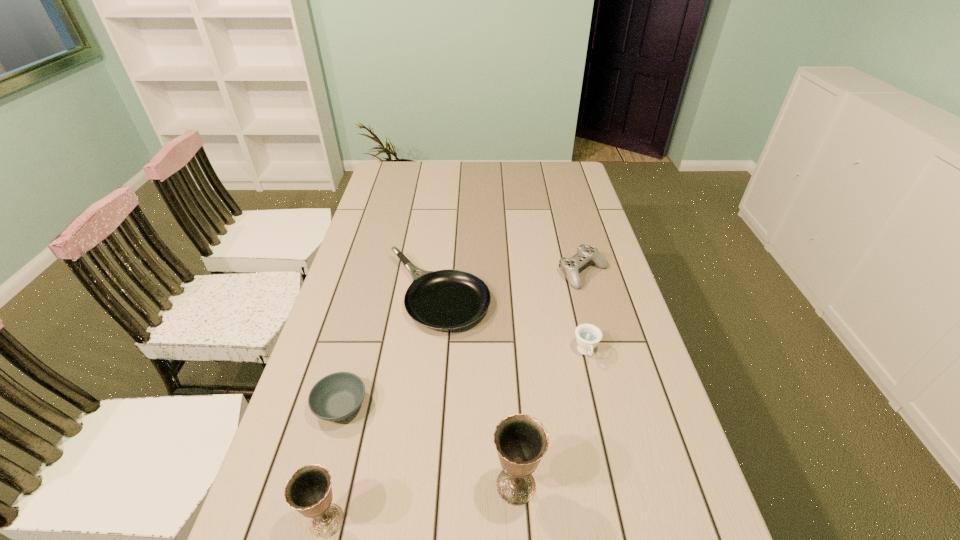
Where is `the right chalice`? the right chalice is located at coordinates (521, 440).

Where is `the tallest object`? Image resolution: width=960 pixels, height=540 pixels. the tallest object is located at coordinates (521, 440).

You are a GUI agent. You are given a task and a screenshot of the screen. Output one action in this format:
    pyautogui.click(x=<x>, y=<y>)
    Task: Click on the control
    
    Given the screenshot: What is the action you would take?
    pyautogui.click(x=569, y=266)

Image resolution: width=960 pixels, height=540 pixels. What are the coordinates of `pan` in the screenshot? It's located at (449, 299).

The height and width of the screenshot is (540, 960). Find the location of `teacup`. teacup is located at coordinates (587, 335).

The image size is (960, 540). I want to click on the third nearest object, so click(x=335, y=397).

Image resolution: width=960 pixels, height=540 pixels. Find the location of `the shortest object`. the shortest object is located at coordinates (335, 397).

Where is `free space located on the back of the right chalice`? This screenshot has height=540, width=960. free space located on the back of the right chalice is located at coordinates (507, 332).

Where is `free space located 0.060m on the back of the control`? The height and width of the screenshot is (540, 960). free space located 0.060m on the back of the control is located at coordinates (576, 247).

The height and width of the screenshot is (540, 960). Identify the location of vacant region located on the right of the pan. (581, 294).